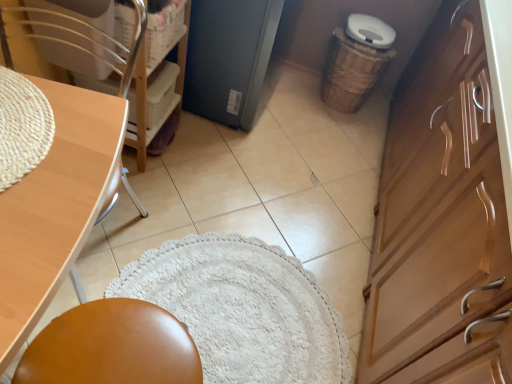
Question: From a real-world perspective, is woven plastic basket at upper left, the 2th basket viewed from the back, positioned above or below matte black refrigerator at center?

Choices:
 (A) below
 (B) above

Answer: (B)

Question: From the image's perspective, is woven plastic basket at upper left, which ranks as the 1th basket in front-to-back order, located above or below matte black refrigerator at center?

Choices:
 (A) above
 (B) below

Answer: (B)

Question: Based on their relative distances, which object is farther from the wooden cabinet at right?

Choices:
 (A) matte black refrigerator at center
 (B) woven plastic basket at upper left, which is the second basket in right-to-left order
 (C) wooden chair at left
 (D) light brown wood desk at left
 (E) woven brown basket at right, which is counted as the 2th basket, starting from the front

Answer: (C)

Question: Estimate the real-world distances between objects in this image. Which object is closer to the light brown wood desk at left?

Choices:
 (A) matte black refrigerator at center
 (B) wooden chair at left
 (C) woven brown basket at right, marked as the second basket in a left-to-right arrangement
 (D) wooden cabinet at right
 (E) woven plastic basket at upper left, which ranks as the 1th basket in front-to-back order

Answer: (B)